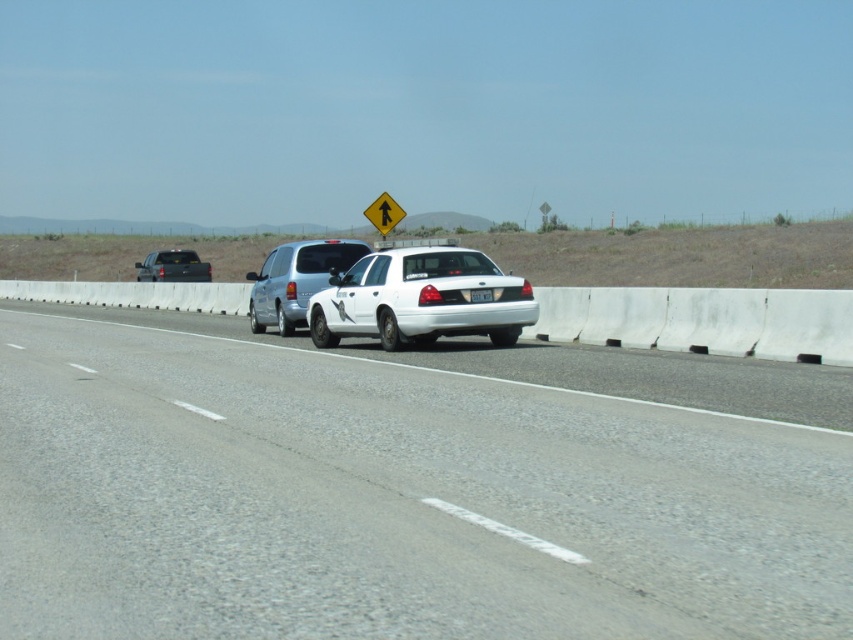
Question: Which is farther from the silver metallic minivan at center?

Choices:
 (A) white glossy car at center
 (B) yellow reflective plastic sign at center

Answer: (B)

Question: Can you confirm if silver metallic minivan at center is positioned above yellow reflective plastic sign at center?

Choices:
 (A) yes
 (B) no

Answer: (B)

Question: Which object is positioned farthest from the silver metallic minivan at center?

Choices:
 (A) white glossy car at center
 (B) matte black truck at left
 (C) white glossy sedan at center
 (D) white plastic license plate at center

Answer: (B)

Question: Does matte black truck at left have a larger size compared to white plastic license plate at center?

Choices:
 (A) yes
 (B) no

Answer: (A)

Question: Which object is the closest to the matte black truck at left?

Choices:
 (A) white glossy car at center
 (B) white plastic license plate at center
 (C) white glossy sedan at center
 (D) silver metallic minivan at center

Answer: (D)

Question: Does white glossy car at center appear on the left side of matte black truck at left?

Choices:
 (A) no
 (B) yes

Answer: (A)